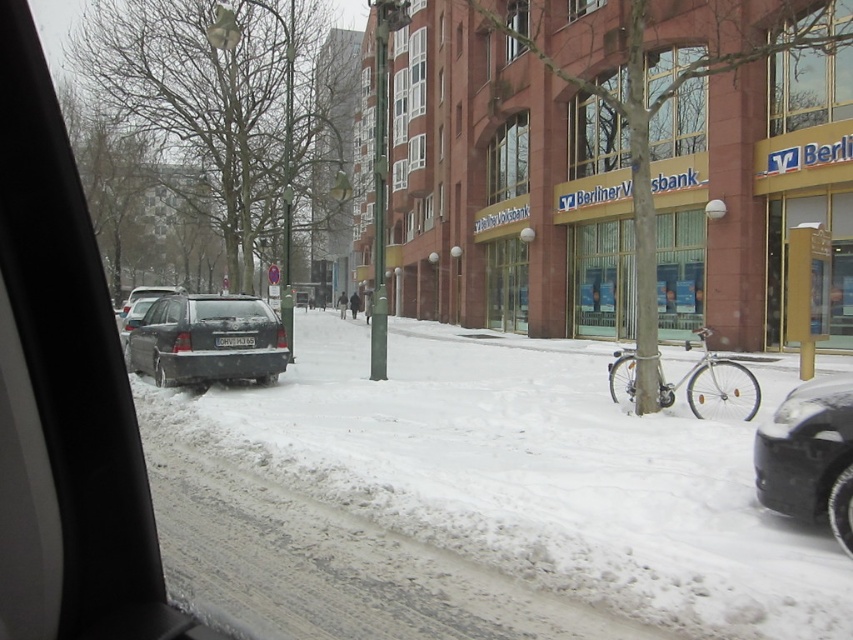
The image size is (853, 640). What do you see at coordinates (207, 340) in the screenshot?
I see `satin black car at left` at bounding box center [207, 340].

Is satin black car at left bigger than transparent glass car window at upper right?

Yes.

You are a GUI agent. You are given a task and a screenshot of the screen. Output one action in this format:
    pyautogui.click(x=<x>, y=<y>)
    Task: Click on the satin black car at left
    
    Given the screenshot: What is the action you would take?
    pyautogui.click(x=207, y=340)

Which is more to the left, black rubber car at lower right or transparent glass at upper center?

From the viewer's perspective, black rubber car at lower right appears more on the left side.

Which is behind, point (770, 508) or point (589, 150)?

Point (589, 150)

Who is more distant from viewer, (802, 403) or (578, 177)?

Positioned behind is point (578, 177).

The image size is (853, 640). In order to click on black rubber car at lower right in this screenshot , I will do `click(809, 456)`.

Is black rubber car at lower right bigger than satin black car at left?

No.

You are a GUI agent. You are given a task and a screenshot of the screen. Output one action in this format:
    pyautogui.click(x=<x>, y=<y>)
    Task: Click on the black rubber car at lower right
    The width and height of the screenshot is (853, 640).
    Given the screenshot: What is the action you would take?
    pyautogui.click(x=809, y=456)

Locate an element on the screen. The height and width of the screenshot is (640, 853). black rubber car at lower right is located at coordinates (x=809, y=456).